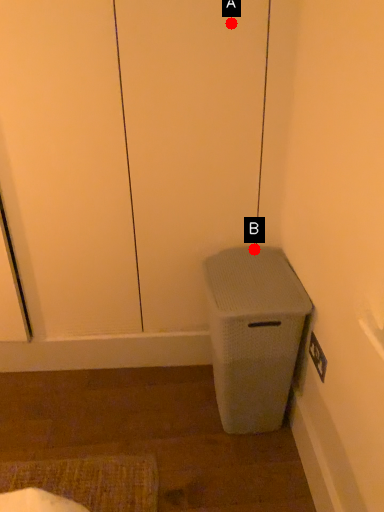
Question: Two points are circled on the image, labeled by A and B beside each circle. Which point is further to the camera?

Choices:
 (A) A is further
 (B) B is further

Answer: (B)